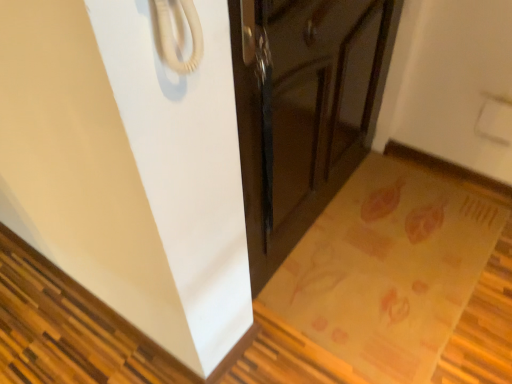
Question: Is yellowish-brown textured mat at lower right inside or outside of glossy dark wood cabinet at center?

Choices:
 (A) outside
 (B) inside

Answer: (A)

Question: From the image's perspective, relative to glossy dark wood cabinet at center, is yellowish-brown textured mat at lower right above or below?

Choices:
 (A) above
 (B) below

Answer: (B)

Question: In the image, is yellowish-brown textured mat at lower right positioned in front of or behind glossy dark wood cabinet at center?

Choices:
 (A) behind
 (B) front

Answer: (A)

Question: In the image, is glossy dark wood cabinet at center on the left side or the right side of yellowish-brown textured mat at lower right?

Choices:
 (A) right
 (B) left

Answer: (B)

Question: In terms of width, does glossy dark wood cabinet at center look wider or thinner when compared to yellowish-brown textured mat at lower right?

Choices:
 (A) thin
 (B) wide

Answer: (A)

Question: Is glossy dark wood cabinet at center inside or outside of yellowish-brown textured mat at lower right?

Choices:
 (A) inside
 (B) outside

Answer: (B)

Question: From the image's perspective, relative to yellowish-brown textured mat at lower right, is glossy dark wood cabinet at center above or below?

Choices:
 (A) above
 (B) below

Answer: (A)